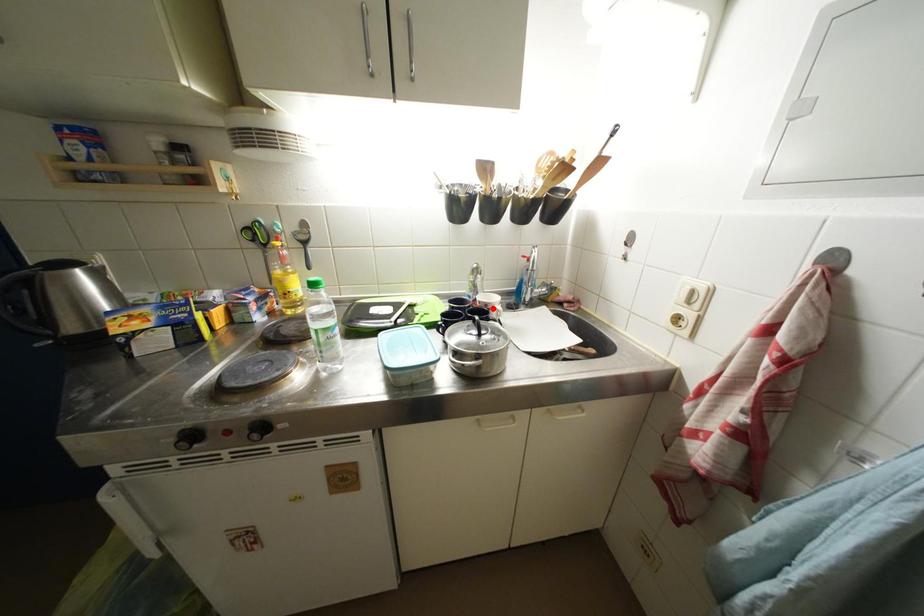
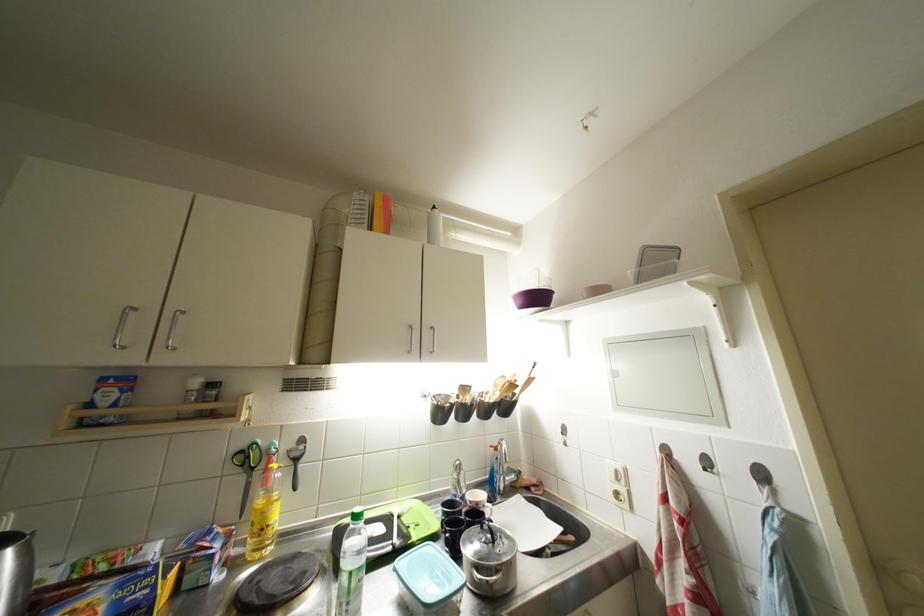
Question: I am providing you with two images of the same scene from different viewpoints. A red point is marked on the first image. Is the red point's position out of view in image 2?

Choices:
 (A) Yes
 (B) No

Answer: (B)